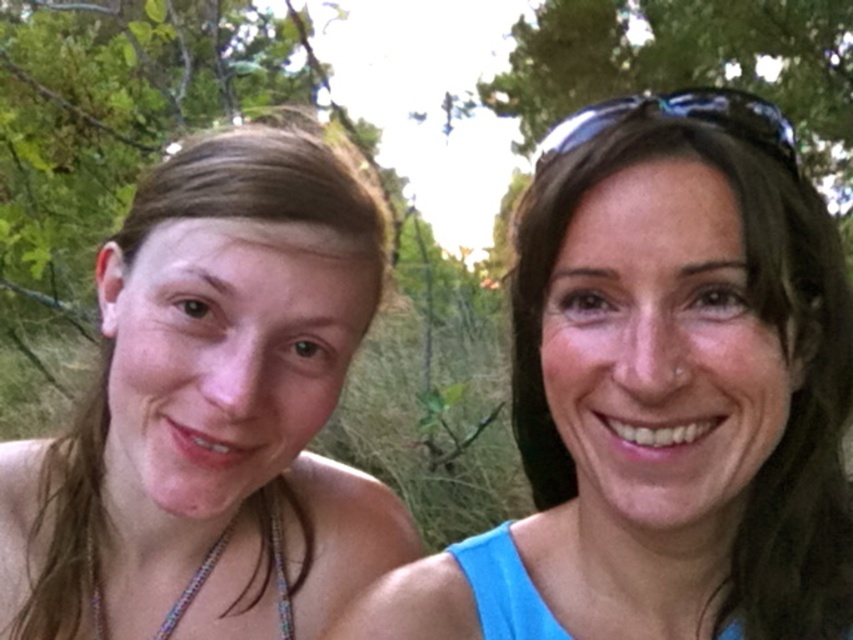
You are taking a photo of two people in a forest. The first person is at point [109,604] and the second person is at point [190,586]. If you want to focus on the person closer to the camera, which point should you aim your camera at?

You should aim your camera at point [109,604] because it is closer to the camera than point [190,586].

You are standing in a forested area with two people. You notice a point marked at coordinates (759, 620). If you want to reach this point quickly, which direction should you move relative to your current position?

The point marked at coordinates (759, 620) is 23.84 inches away from the viewer. To reach it quickly, you should move forward since it is in front of you.

You are holding a 60 cm long measuring tape and want to measure the distance from your current position to the point at coordinates point (590, 524). Can you reach the point with the measuring tape?

The distance of point (590, 524) from camera is 64.53 centimeters. Since the measuring tape is only 60 cm long, it is not long enough to reach the point.